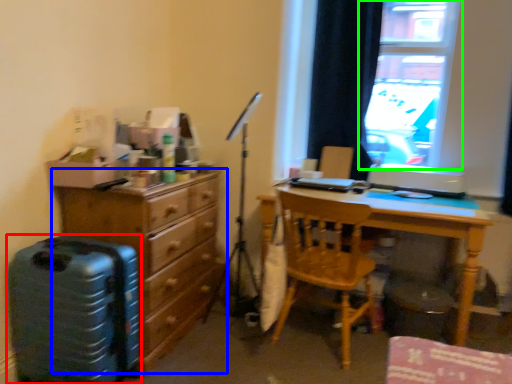
Question: Considering the real-world distances, which object is farthest from luggage (highlighted by a red box)? chest of drawers (highlighted by a blue box) or window (highlighted by a green box)?

Choices:
 (A) chest of drawers
 (B) window

Answer: (B)